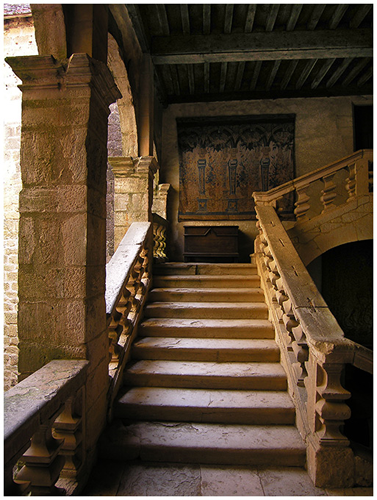
This screenshot has height=500, width=377. In order to click on archway in this screenshot , I will do `click(369, 239)`.